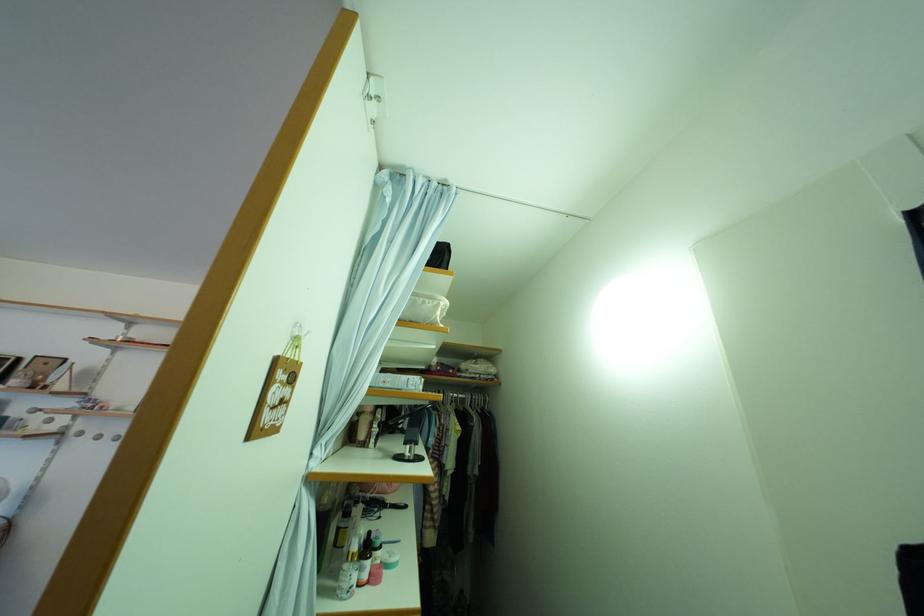
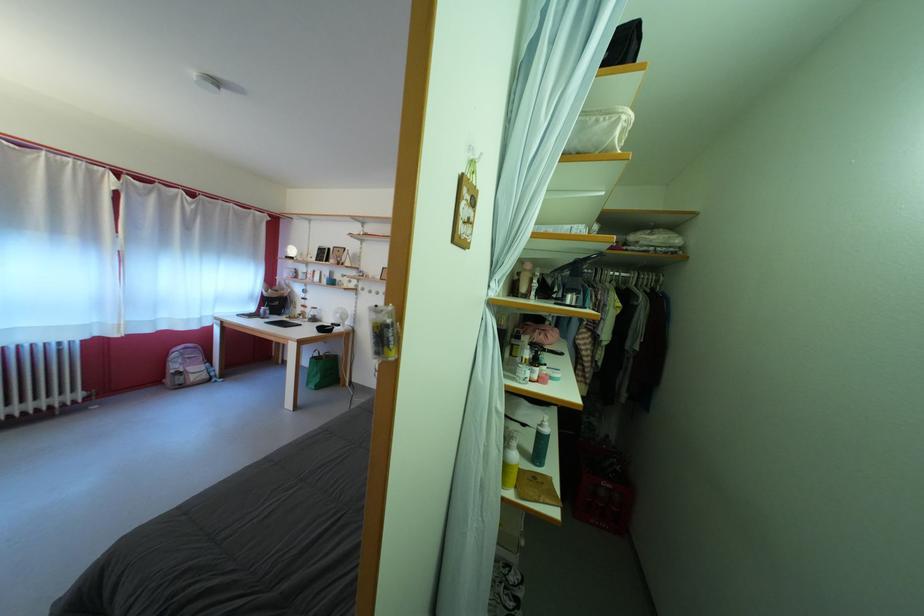
Find the pixel in the second image that matches (x=448, y=262) in the first image.

(631, 54)